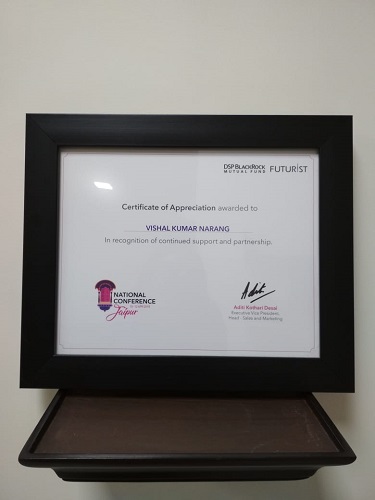
This screenshot has width=375, height=500. In order to click on glass case of picture frame in this screenshot , I will do `click(199, 292)`.